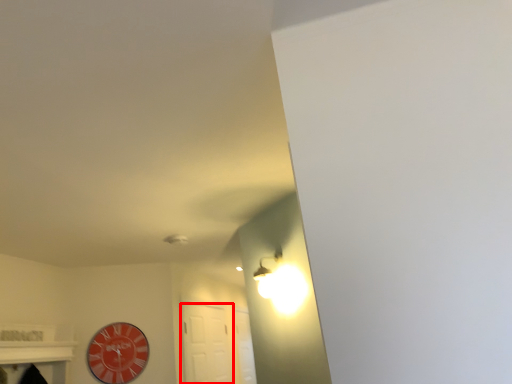
Question: From the image's perspective, where is door (annotated by the red box) located relative to wall clock?

Choices:
 (A) below
 (B) above

Answer: (A)